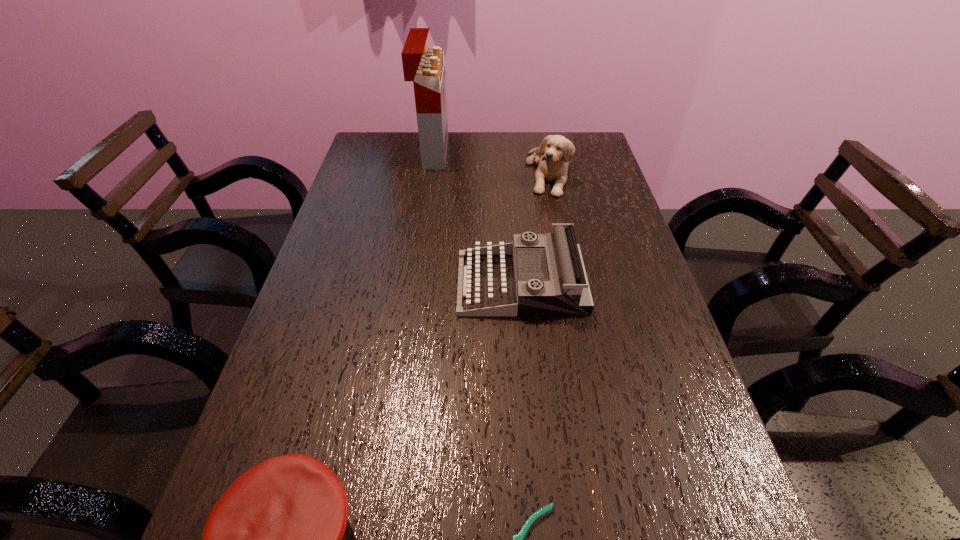
The width and height of the screenshot is (960, 540). Find the location of `cigarette case`. cigarette case is located at coordinates (425, 67).

Find the location of `the fourth shortest object`. the fourth shortest object is located at coordinates (555, 151).

This screenshot has height=540, width=960. I want to click on typewriter, so click(x=567, y=293).

At what (x,y) coordinates should I click in order to perform the action: click on vacant space located 0.290m with the lid open on the cigarette case. Please return your answer as a coordinate pair (x, y). Looking at the image, I should click on (532, 152).

Locate an element on the screen. This screenshot has width=960, height=540. free spot located on the front-facing side of the puppy is located at coordinates (567, 268).

This screenshot has height=540, width=960. Identify the location of free spot located on the typing side of the third nearest object. (400, 284).

This screenshot has height=540, width=960. I want to click on vacant space situated 0.060m on the typing side of the third nearest object, so click(433, 284).

This screenshot has width=960, height=540. What are the coordinates of `vacant space located 0.200m on the typing side of the third nearest object` in the screenshot? It's located at (375, 284).

Where is `cigarette case that is positioned at the far edge`? The width and height of the screenshot is (960, 540). cigarette case that is positioned at the far edge is located at coordinates tap(425, 67).

This screenshot has width=960, height=540. I want to click on puppy located at the far edge, so click(x=555, y=151).